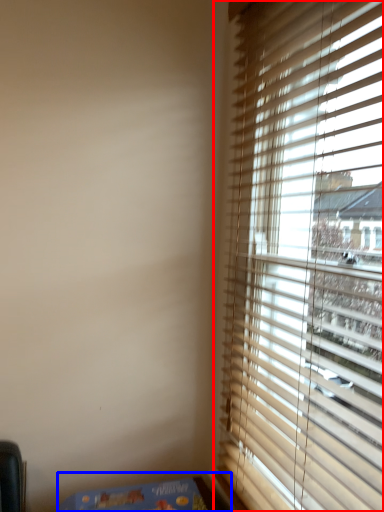
Question: Which object is further to the camera taking this photo, window (highlighted by a red box) or table (highlighted by a blue box)?

Choices:
 (A) window
 (B) table

Answer: (B)